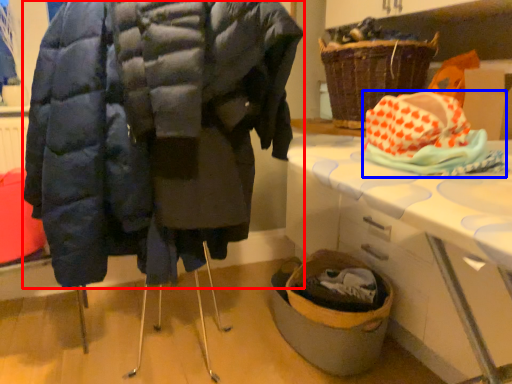
Question: Among these objects, which one is farthest to the camera, coat (highlighted by a red box) or material (highlighted by a blue box)?

Choices:
 (A) coat
 (B) material

Answer: (B)